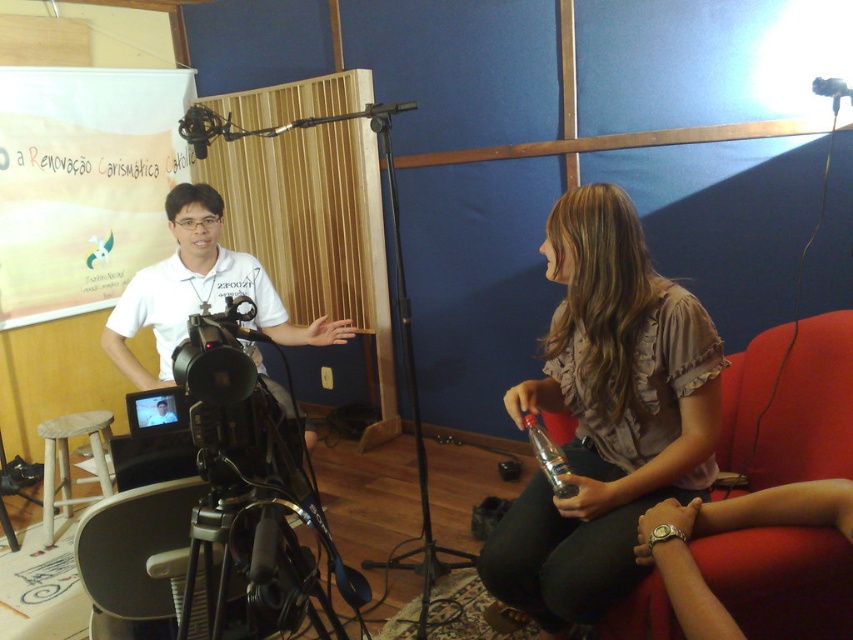
Who is more forward, (554, 252) or (547, 456)?

Point (547, 456)

Does matte brown blouse at right appear on the right side of clear plastic microphone at lower center?

Correct, you'll find matte brown blouse at right to the right of clear plastic microphone at lower center.

Where is `matte brown blouse at right`? Image resolution: width=853 pixels, height=640 pixels. matte brown blouse at right is located at coordinates (606, 416).

Is black metal tripod at center wider than clear plastic microphone at lower center?

Correct, the width of black metal tripod at center exceeds that of clear plastic microphone at lower center.

Is black metal tripod at center above clear plastic microphone at lower center?

Indeed, black metal tripod at center is positioned over clear plastic microphone at lower center.

Who is more distant from viewer, (419, 458) or (544, 458)?

Point (419, 458)

Locate an element on the screen. This screenshot has width=853, height=640. black metal tripod at center is located at coordinates (409, 392).

Consider the image. Is black metal tripod at center positioned at the back of matte white shirt at center?

Yes.

Which is behind, point (404, 376) or point (173, 413)?

Point (404, 376)

Locate an element on the screen. black metal tripod at center is located at coordinates tap(409, 392).